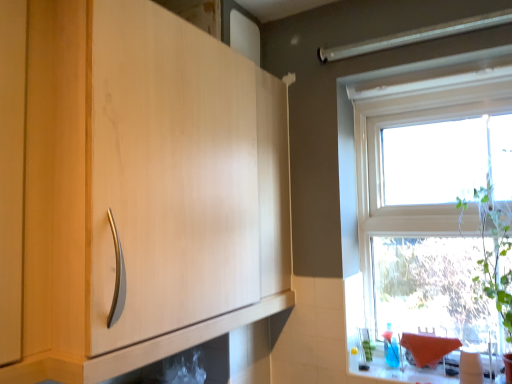
The height and width of the screenshot is (384, 512). What are the coordinates of `matte wood cabinet at center` in the screenshot? It's located at (134, 189).

Find the location of `matte wood cabinet at center`. matte wood cabinet at center is located at coordinates (134, 189).

Is transparent glass window at upper right located outside matte wood cabinet at center?

Yes, transparent glass window at upper right is not within matte wood cabinet at center.

Considering the sizes of transparent glass window at upper right and matte wood cabinet at center in the image, is transparent glass window at upper right wider or thinner than matte wood cabinet at center?

transparent glass window at upper right is thinner than matte wood cabinet at center.

Does transparent glass window at upper right turn towards matte wood cabinet at center?

No, transparent glass window at upper right is not aimed at matte wood cabinet at center.

Find the location of a particular element. Image resolution: width=512 pixels, height=384 pixels. window behind the white glossy counter top at lower right is located at coordinates (428, 207).

From the image's perspective, is white glossy counter top at lower right above transparent glass window at upper right?

No, from the image's perspective, white glossy counter top at lower right is not over transparent glass window at upper right.

Which object is closer to the camera, white glossy counter top at lower right or transparent glass window at upper right?

white glossy counter top at lower right is closer to the camera.

From a real-world perspective, which is physically above, white glossy counter top at lower right or transparent glass window at upper right?

transparent glass window at upper right.

Is matte wood cabinet at center completely or partially outside of transparent glass window at upper right?

matte wood cabinet at center is positioned outside transparent glass window at upper right.

From a real-world perspective, is matte wood cabinet at center on top of transparent glass window at upper right?

Yes, from a real-world perspective, matte wood cabinet at center is above transparent glass window at upper right.

Find the location of a particular element. This screenshot has width=512, height=384. cabinetry above the transparent glass window at upper right (from a real-world perspective) is located at coordinates (134, 189).

Considering the sizes of objects matte wood cabinet at center and transparent glass window at upper right in the image provided, who is wider, matte wood cabinet at center or transparent glass window at upper right?

matte wood cabinet at center is wider.

From the image's perspective, is transparent glass window at upper right on top of white glossy counter top at lower right?

Correct, transparent glass window at upper right appears higher than white glossy counter top at lower right in the image.

Can you confirm if transparent glass window at upper right is thinner than white glossy counter top at lower right?

Yes.

Relative to white glossy counter top at lower right, is transparent glass window at upper right in front or behind?

transparent glass window at upper right is positioned farther from the viewer than white glossy counter top at lower right.

Are transparent glass window at upper right and white glossy counter top at lower right making contact?

No, transparent glass window at upper right is not touching white glossy counter top at lower right.

Between matte wood cabinet at center and white glossy counter top at lower right, which one has more height?

With more height is matte wood cabinet at center.

Would you say matte wood cabinet at center is outside white glossy counter top at lower right?

Indeed, matte wood cabinet at center is completely outside white glossy counter top at lower right.

Which of these two, matte wood cabinet at center or white glossy counter top at lower right, is thinner?

With smaller width is white glossy counter top at lower right.

Is point (484, 371) closer or farther from the camera than point (5, 217)?

Point (484, 371).

From a real-world perspective, is white glossy counter top at lower right located higher than matte wood cabinet at center?

No, from a real-world perspective, white glossy counter top at lower right is not above matte wood cabinet at center.

Image resolution: width=512 pixels, height=384 pixels. Identify the location of counter top behind the matte wood cabinet at center. (410, 369).

Which of these two, white glossy counter top at lower right or matte wood cabinet at center, is wider?

With larger width is matte wood cabinet at center.

Locate an element on the screen. cabinetry above the transparent glass window at upper right (from the image's perspective) is located at coordinates (134, 189).

Locate an element on the screen. counter top that is in front of the transparent glass window at upper right is located at coordinates (410, 369).

Looking at the image, which one is located closer to transparent glass window at upper right, matte wood cabinet at center or white glossy counter top at lower right?

The object closer to transparent glass window at upper right is white glossy counter top at lower right.

Looking at the image, which one is located further to matte wood cabinet at center, white glossy counter top at lower right or transparent glass window at upper right?

white glossy counter top at lower right.

When comparing their distances from white glossy counter top at lower right, does transparent glass window at upper right or matte wood cabinet at center seem further?

matte wood cabinet at center is further to white glossy counter top at lower right.

When comparing their distances from white glossy counter top at lower right, does matte wood cabinet at center or transparent glass window at upper right seem further?

matte wood cabinet at center is positioned further to the anchor white glossy counter top at lower right.

From the image, which object appears to be nearer to transparent glass window at upper right, white glossy counter top at lower right or matte wood cabinet at center?

The object closer to transparent glass window at upper right is white glossy counter top at lower right.

When comparing their distances from matte wood cabinet at center, does transparent glass window at upper right or white glossy counter top at lower right seem further?

white glossy counter top at lower right lies further to matte wood cabinet at center than the other object.

Where is `counter top located between matte wood cabinet at center and transparent glass window at upper right in the left-right direction`? This screenshot has height=384, width=512. counter top located between matte wood cabinet at center and transparent glass window at upper right in the left-right direction is located at coordinates (410, 369).